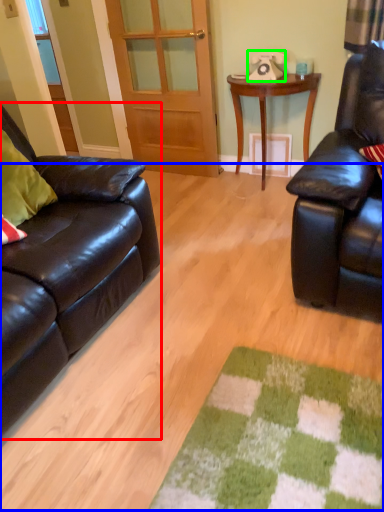
Question: Considering the real-world distances, which object is farthest from studio couch (highlighted by a red box)? plain (highlighted by a blue box) or corded phone (highlighted by a green box)?

Choices:
 (A) plain
 (B) corded phone

Answer: (B)